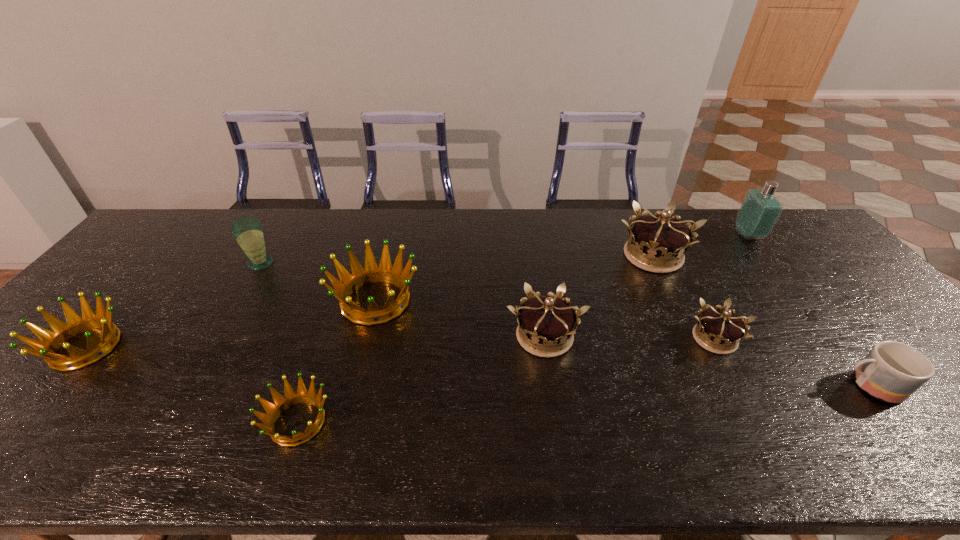
Identify the location of the second smallest golden crown. This screenshot has width=960, height=540. (51, 341).

Locate an element on the screen. The width and height of the screenshot is (960, 540). mug is located at coordinates (892, 371).

Identify the location of the nearest crown. (281, 403).

Where is `the smallest golden crown`? The width and height of the screenshot is (960, 540). the smallest golden crown is located at coordinates (281, 403).

Find the location of a particular element. The height and width of the screenshot is (540, 960). blank area located 0.200m on the front label of the perfume is located at coordinates (678, 235).

This screenshot has height=540, width=960. Find the location of `free space located 0.360m on the front label of the perfume`. free space located 0.360m on the front label of the perfume is located at coordinates (630, 235).

Find the location of `blank area located 0.390m on the front label of the perfume`. blank area located 0.390m on the front label of the perfume is located at coordinates (621, 235).

At what (x,y) coordinates should I click in order to perform the action: click on free region located on the right of the tallest crown. Please return your answer as a coordinate pair (x, y). Image resolution: width=960 pixels, height=540 pixels. Looking at the image, I should click on (719, 255).

Image resolution: width=960 pixels, height=540 pixels. I want to click on vacant space located 0.400m on the front of the glass, so click(190, 383).

Identify the location of free spot located on the left of the leftmost gold crown. (474, 336).